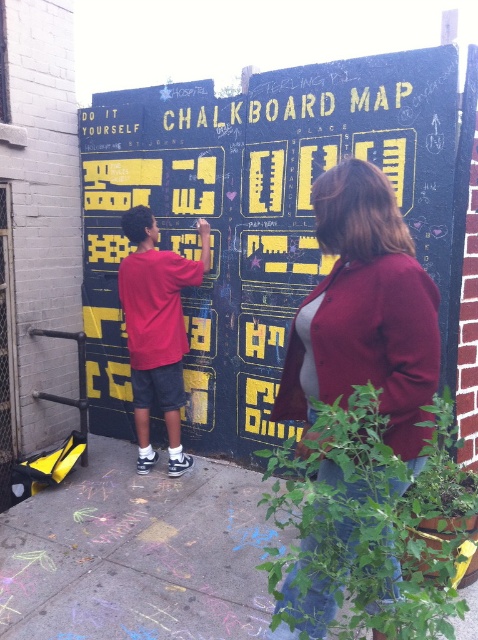
Who is shorter, black chalkboard map at center or maroon sweater at center?

Standing shorter between the two is maroon sweater at center.

Locate an element on the screen. Image resolution: width=478 pixels, height=640 pixels. black chalkboard map at center is located at coordinates (253, 218).

Does maroon sweater at center lie in front of matte red shirt at left?

Yes, it is in front of matte red shirt at left.

Does maroon sweater at center appear under matte red shirt at left?

Correct, maroon sweater at center is located below matte red shirt at left.

Identify the location of maroon sweater at center. The width and height of the screenshot is (478, 640). (365, 314).

You are a GUI agent. You are given a task and a screenshot of the screen. Output one action in this format:
    pyautogui.click(x=<x>, y=<y>)
    Task: Click on the maroon sweater at center
    This screenshot has width=478, height=640.
    Given the screenshot: What is the action you would take?
    pyautogui.click(x=365, y=314)

Locate an element on the screen. This screenshot has height=640, width=478. black chalkboard map at center is located at coordinates (253, 218).

Does black chalkboard map at center appear on the right side of matte red shirt at left?

Yes, black chalkboard map at center is to the right of matte red shirt at left.

Image resolution: width=478 pixels, height=640 pixels. What are the coordinates of `black chalkboard map at center` in the screenshot? It's located at (253, 218).